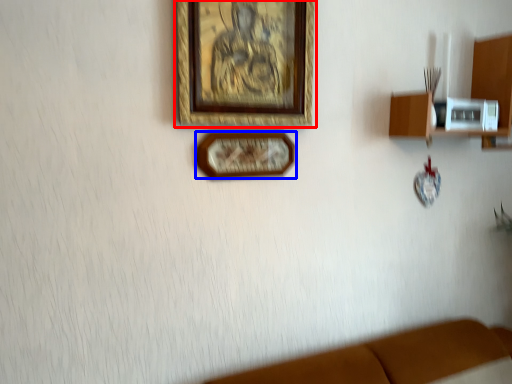
Question: Which object appears farthest to the camera in this image, picture frame (highlighted by a red box) or picture frame (highlighted by a blue box)?

Choices:
 (A) picture frame
 (B) picture frame

Answer: (B)